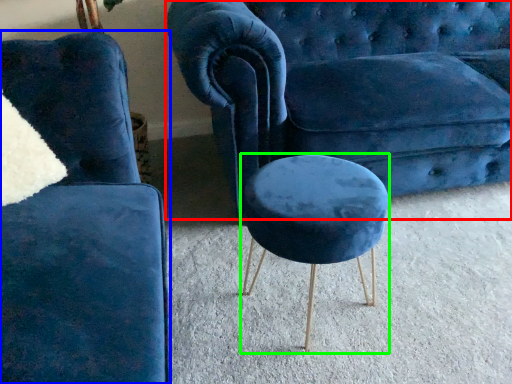
Question: Which object is the closest to the studio couch (highlighted by a red box)? Choose among these: chair (highlighted by a blue box) or stool (highlighted by a green box).

Choices:
 (A) chair
 (B) stool

Answer: (B)